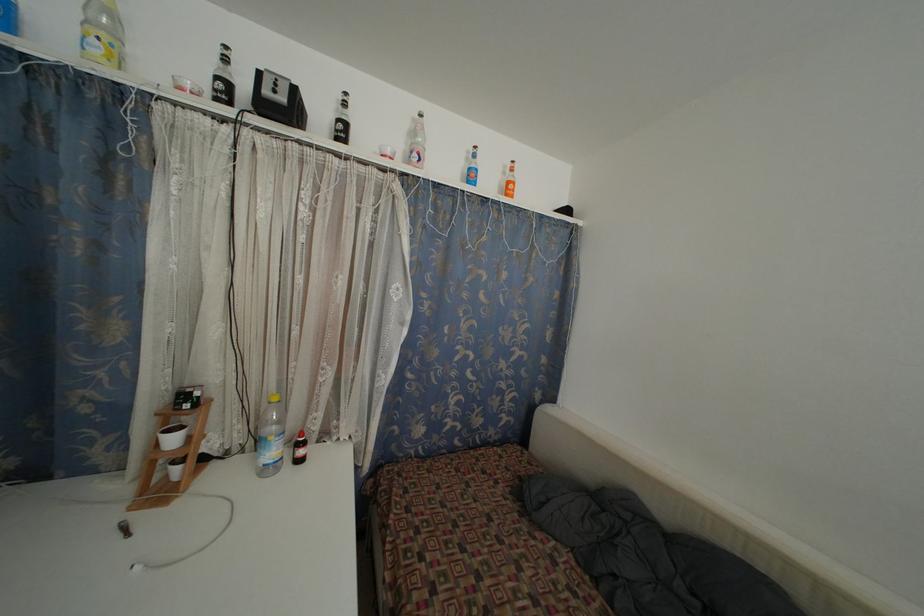
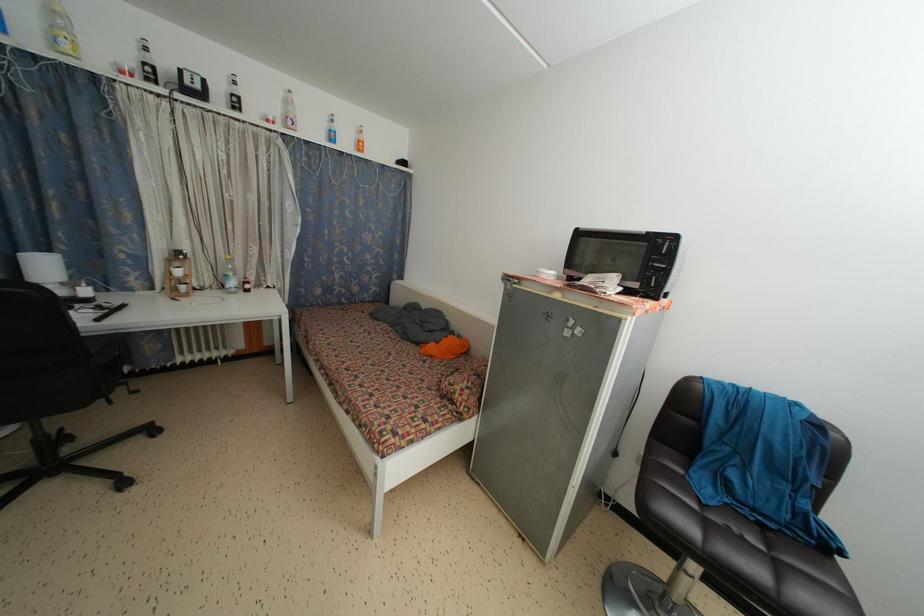
In the second image, find the point that corresponds to point 345,132 in the first image.

(238, 105)